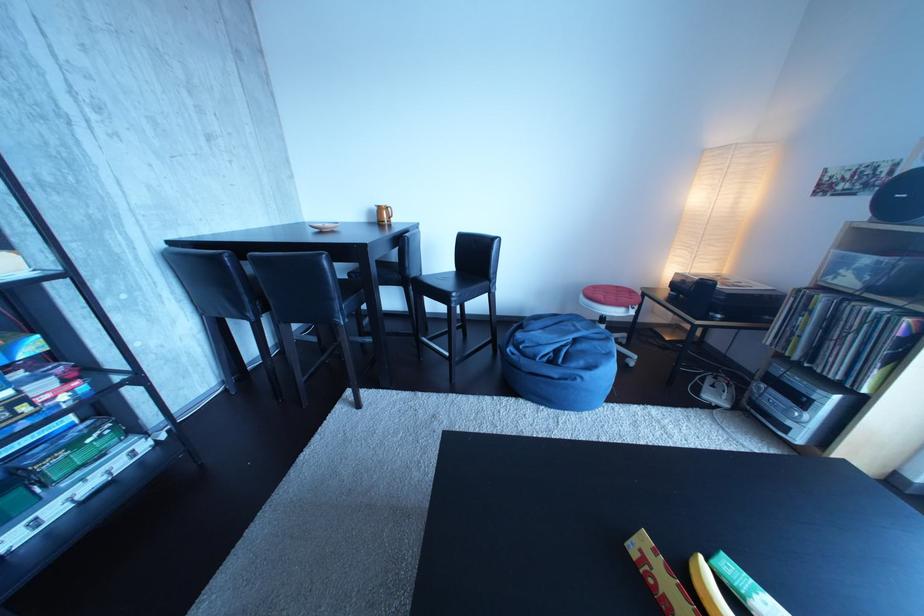
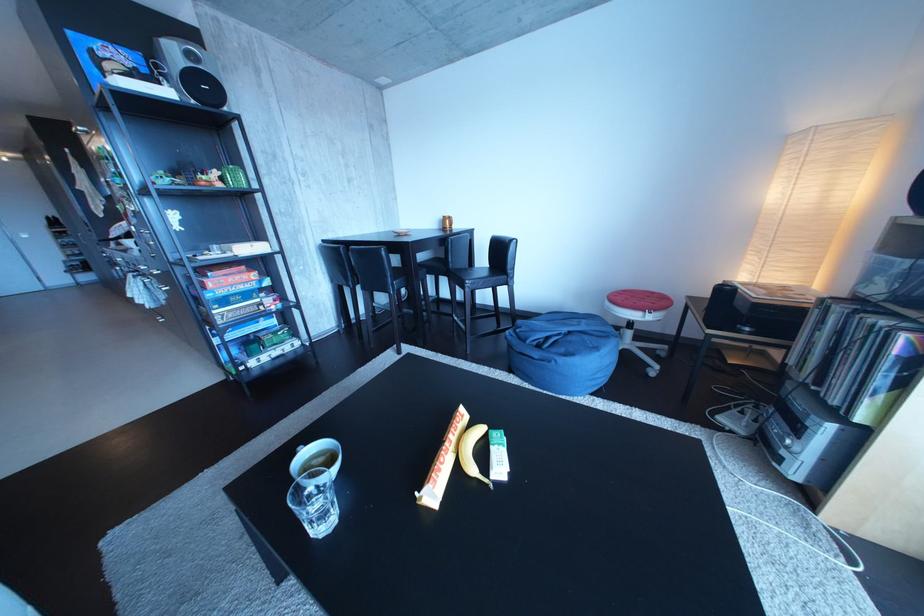
Locate, in the second image, the point that corresponds to point 467,301 in the first image.

(480, 286)